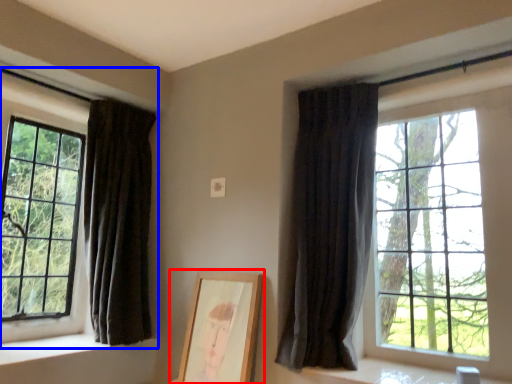
Question: Which object appears closest to the camera in this image, picture frame (highlighted by a red box) or window (highlighted by a blue box)?

Choices:
 (A) picture frame
 (B) window

Answer: (A)